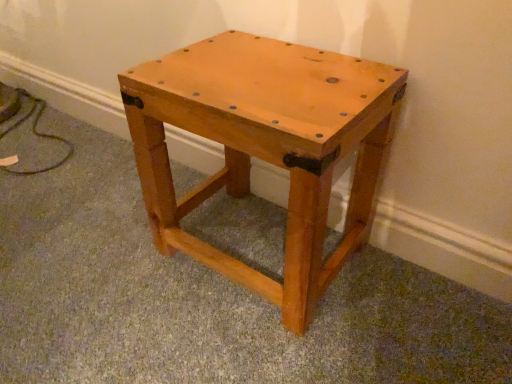
This screenshot has height=384, width=512. What do you see at coordinates (266, 147) in the screenshot?
I see `light brown wood stool at center` at bounding box center [266, 147].

At what (x,y) coordinates should I click in order to perform the action: click on light brown wood stool at center. Please return your answer as a coordinate pair (x, y). The height and width of the screenshot is (384, 512). Looking at the image, I should click on 266,147.

Locate an element on the screen. This screenshot has width=512, height=384. light brown wood stool at center is located at coordinates (266, 147).